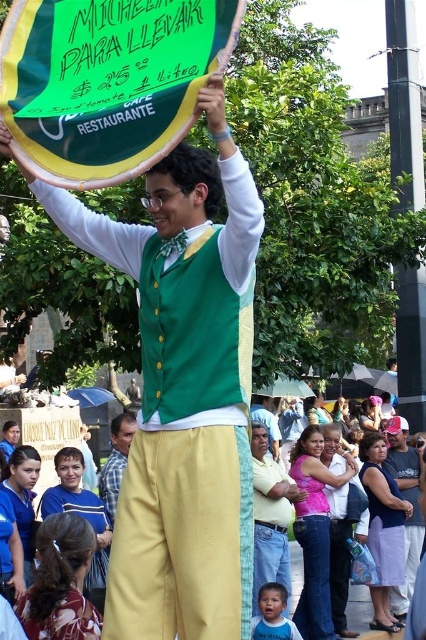
You are a fashion designer observing the scene. You notice the yellow fabric pants at center and the smooth blue shirt at lower center. Which clothing item is placed higher on the person?

The yellow fabric pants at center is positioned over smooth blue shirt at lower center, so the yellow fabric pants at center is higher.

You are standing in the crowd at the festival and want to move closer to the stilt walker holding the sign. Which point, point 1 at coordinates (x=417, y=467) or point 2 at coordinates (x=368, y=595), is closer to you and would be a better starting point to approach the stilt walker?

Point 1 at coordinates (x=417, y=467) is closer to you and would be a better starting point to approach the stilt walker because it is closer to the viewer than point 2 at coordinates (x=368, y=595).

You are a fashion designer observing the outdoor event. You notice two pairs of pants in the crowd. The denim pants at lower right and the yellow fabric pants at center. Which pair has a narrower leg width?

The denim pants at lower right has a narrower leg width than the yellow fabric pants at center because the denim pants at lower right is thinner than yellow fabric pants at center.